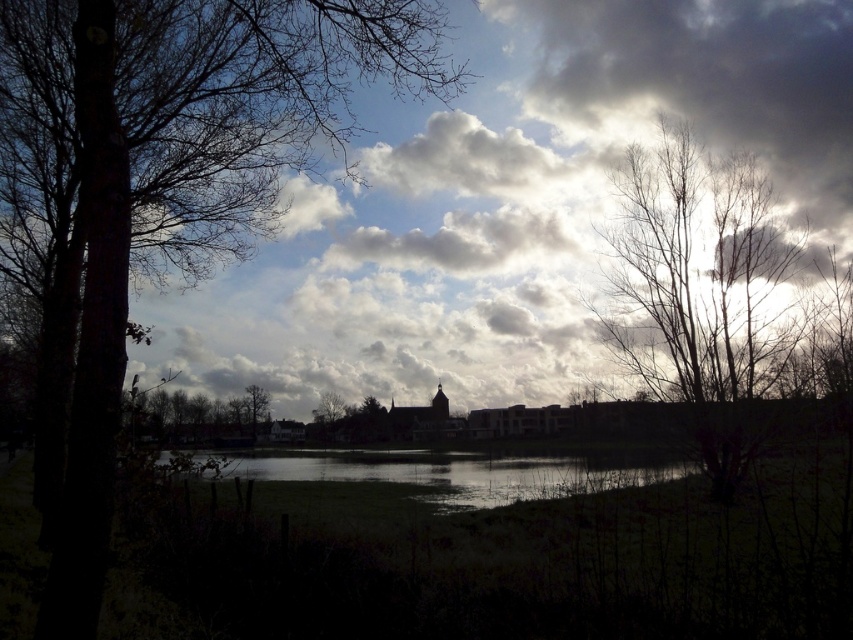
Question: Is cloudy sky at upper center closer to the viewer compared to brown rough bark tree at left?

Choices:
 (A) no
 (B) yes

Answer: (A)

Question: Which point is closer to the camera?

Choices:
 (A) (62, 349)
 (B) (190, 442)
 (C) (567, 378)
 (D) (229, 477)

Answer: (A)

Question: Can you confirm if cloudy sky at upper center is positioned to the right of bare branches at center?

Choices:
 (A) no
 (B) yes

Answer: (A)

Question: Can you confirm if dark brown bark tree at center is positioned to the right of green matte tree at center?

Choices:
 (A) no
 (B) yes

Answer: (A)

Question: Among these points, which one is nearest to the camera?

Choices:
 (A) (340, 404)
 (B) (440, 467)

Answer: (A)

Question: Which point is closer to the camera?

Choices:
 (A) (206, 404)
 (B) (169, 451)

Answer: (B)